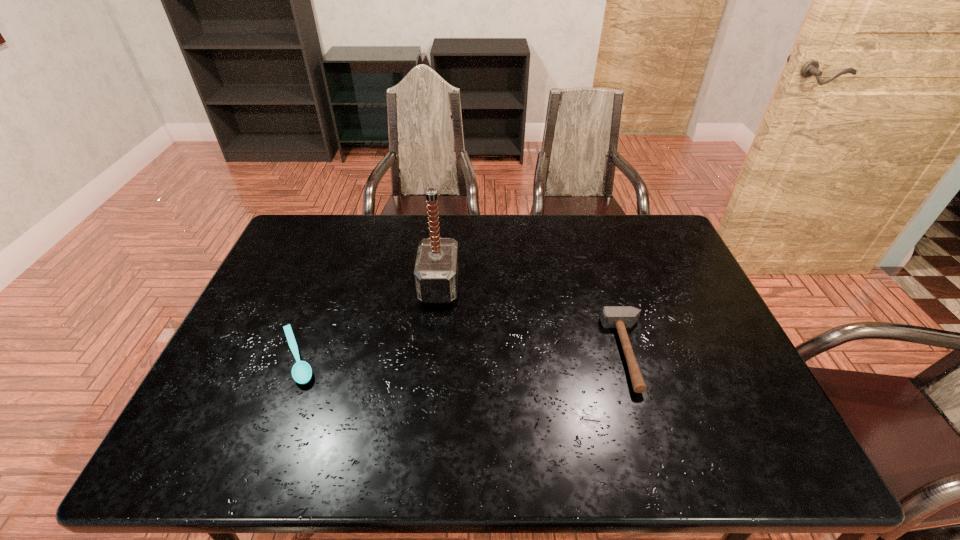
Image resolution: width=960 pixels, height=540 pixels. I want to click on vacant area between the shorter hammer and the leftmost object, so click(x=464, y=355).

Find the location of `vacant point located between the farthest object and the shortest object`. vacant point located between the farthest object and the shortest object is located at coordinates 369,321.

You are a GUI agent. You are given a task and a screenshot of the screen. Output one action in this format:
    pyautogui.click(x=<x>, y=<y>)
    Task: Click on the free spot between the rightmost object and the spoon
    The image size is (960, 540).
    Given the screenshot: What is the action you would take?
    pyautogui.click(x=464, y=355)

Where is `vacant area between the right hammer and the leftmost object`? vacant area between the right hammer and the leftmost object is located at coordinates (464, 355).

Locate an element on the screen. This screenshot has height=540, width=960. unoccupied area between the taller hammer and the right hammer is located at coordinates (534, 319).

This screenshot has height=540, width=960. What are the coordinates of `free point between the right hammer and the farthest object` in the screenshot? It's located at (534, 319).

Where is `vacant area between the tallest object and the second shortest object`? vacant area between the tallest object and the second shortest object is located at coordinates (534, 319).

Find the location of a particular element. The height and width of the screenshot is (540, 960). free spot between the left hammer and the nearer hammer is located at coordinates 534,319.

Identify which object is the second closest to the left hammer. Please provide its 2D coordinates. Your answer should be formatted as a tuple, i.e. [(x, y)], where the tuple contains the x and y coordinates of a point satisfying the conditions above.

[(621, 317)]

Locate which object is the second closest to the farther hammer. Please provide its 2D coordinates. Your answer should be formatted as a tuple, i.e. [(x, y)], where the tuple contains the x and y coordinates of a point satisfying the conditions above.

[(621, 317)]